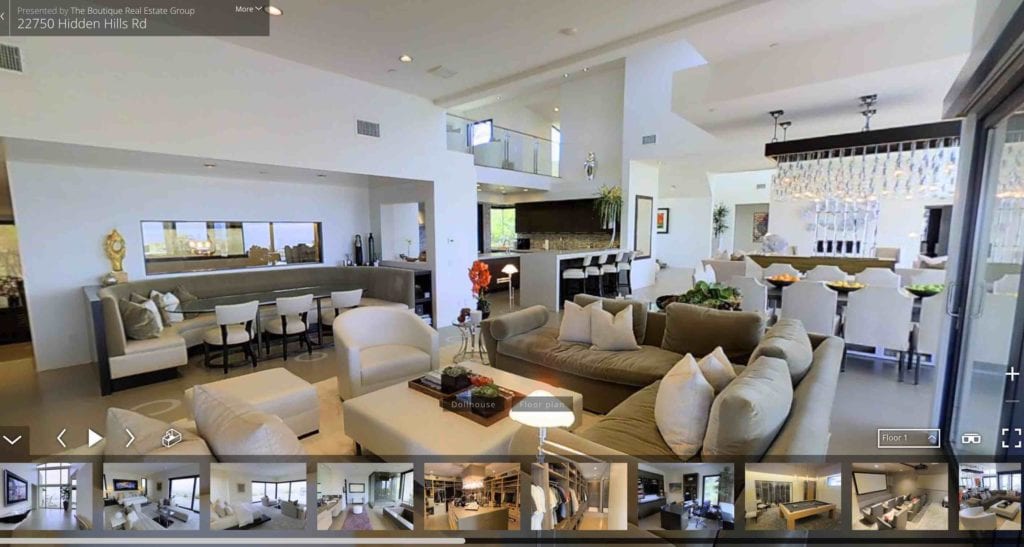
Where is `cusions`? The width and height of the screenshot is (1024, 547). cusions is located at coordinates point(682,401).